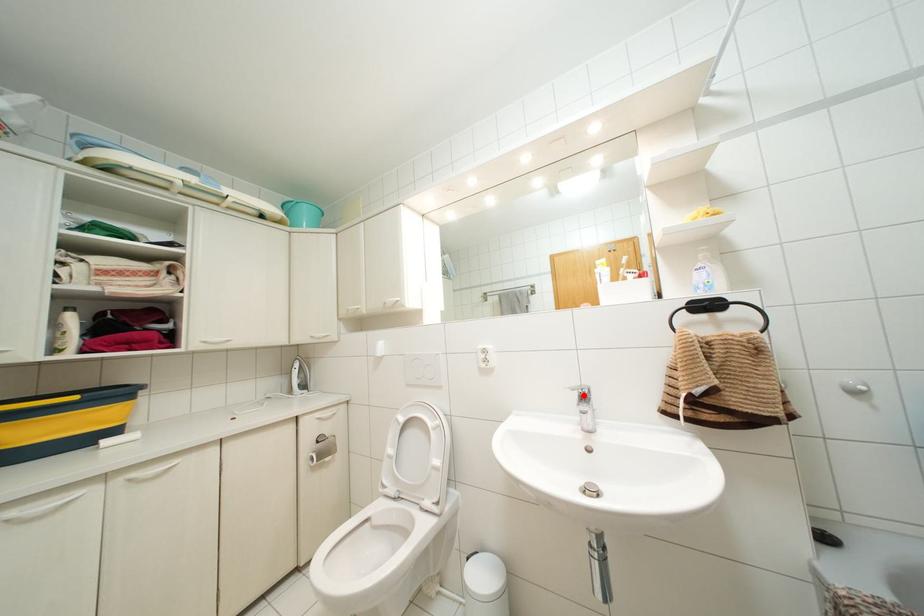
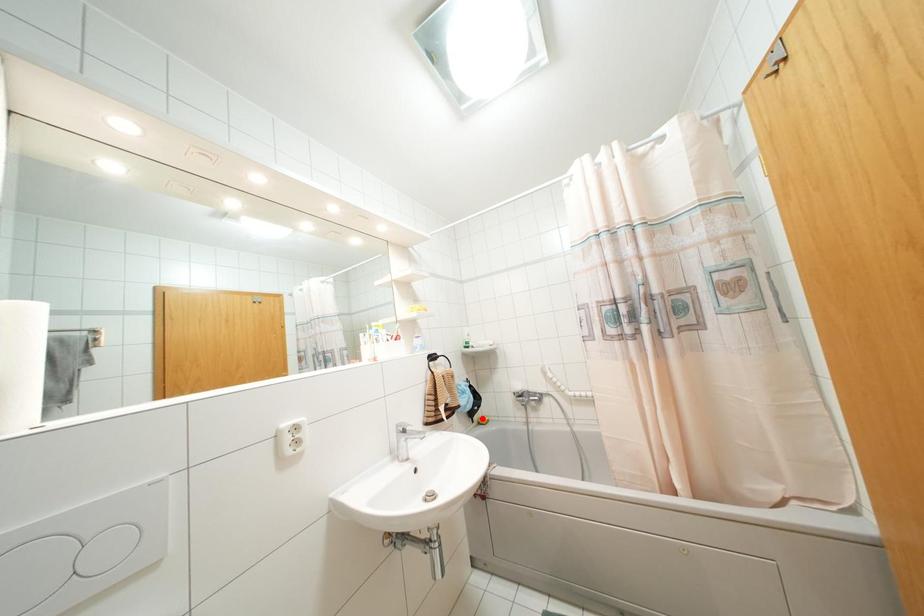
I am providing you with two images of the same scene from different viewpoints. A red point is marked on the first image and another point is marked on the second image. Is the red point in image1 aligned with the point shown in image2?

No